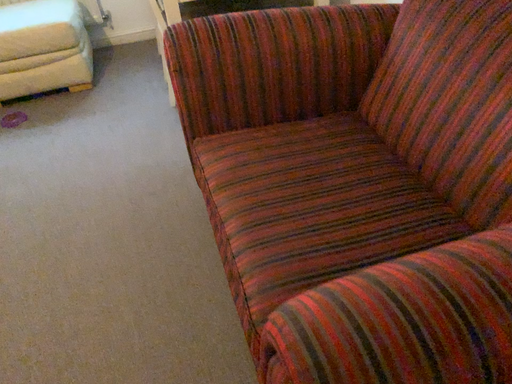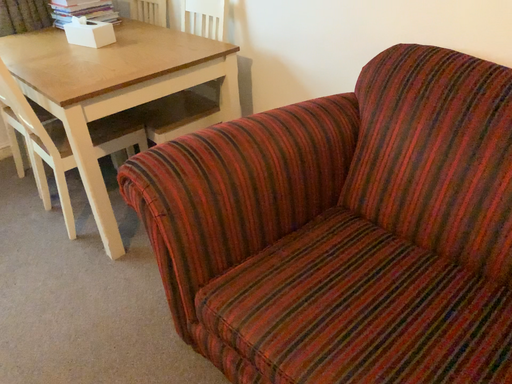
Question: How did the camera likely rotate when shooting the video?

Choices:
 (A) rotated right
 (B) rotated left

Answer: (A)